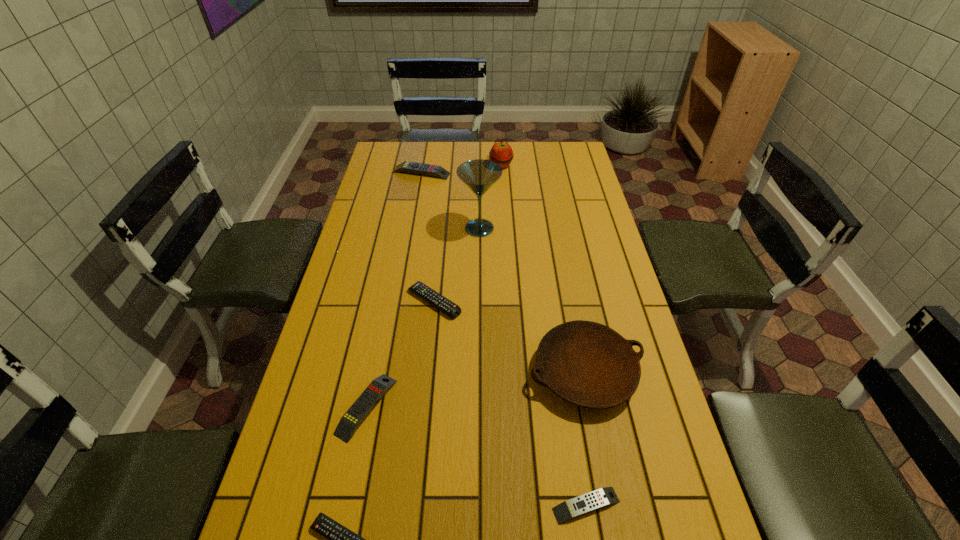
Where is `apple at the far edge`? apple at the far edge is located at coordinates (501, 153).

Where is `remote control at the far edge`? remote control at the far edge is located at coordinates (410, 167).

Identify the location of plate present at the right edge. (588, 364).

The image size is (960, 540). I want to click on remote control at the right edge, so click(600, 498).

You are a GUI agent. You are given a task and a screenshot of the screen. Output one action in this format:
    pyautogui.click(x=<x>, y=<y>)
    Task: Click on the object present at the far left corner
    The image size is (960, 540).
    Given the screenshot: What is the action you would take?
    pyautogui.click(x=410, y=167)

Locate an element on the screen. Image resolution: width=960 pixels, height=540 pixels. vacant space at the far edge of the desktop is located at coordinates (511, 146).

Find the location of `free space at the left edge`. free space at the left edge is located at coordinates (349, 354).

Identify the location of vacant space at the right edge of the desktop. (589, 308).

This screenshot has width=960, height=540. Identify the location of vacant space at the far left corner of the desktop. (396, 159).

Image resolution: width=960 pixels, height=540 pixels. What are the coordinates of `vacant area between the fourth nearest remote control and the brown plate` in the screenshot? It's located at [x=510, y=337].